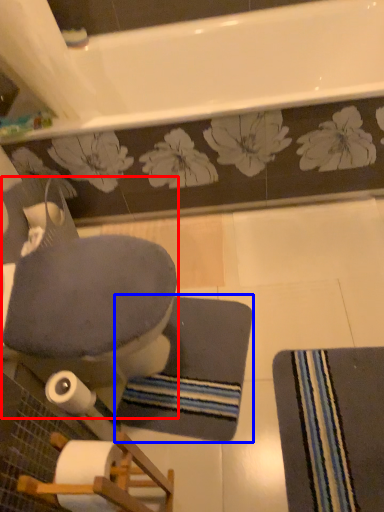
Question: Which point is further to the camera, rocking chair (highlighted by a red box) or bath mat (highlighted by a blue box)?

Choices:
 (A) rocking chair
 (B) bath mat

Answer: (B)